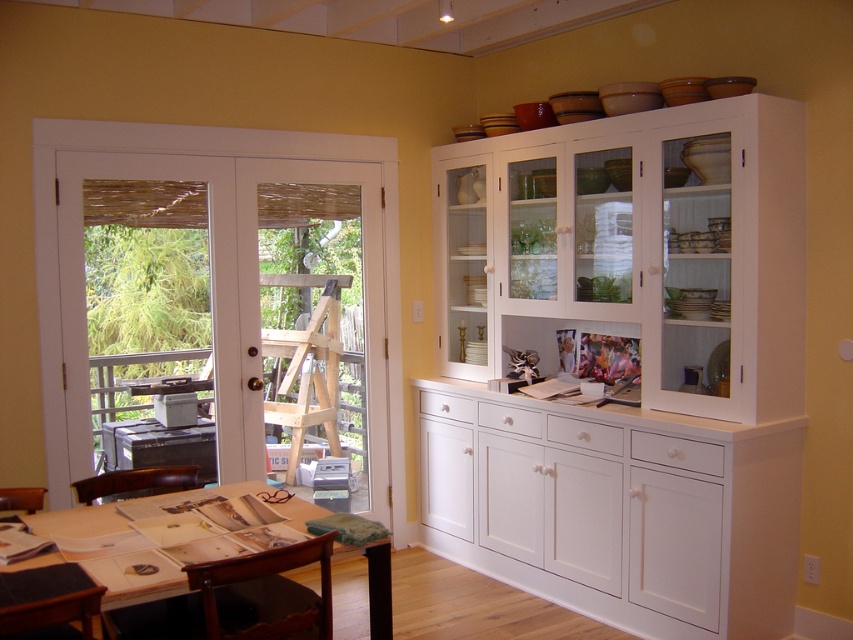
Question: Does white glass door at left have a greater width compared to wooden table at lower left?

Choices:
 (A) no
 (B) yes

Answer: (A)

Question: Which object appears farthest from the camera in this image?

Choices:
 (A) white glass door at left
 (B) wooden table at lower left

Answer: (A)

Question: Where is white glass door at left located in relation to wooden table at lower left in the image?

Choices:
 (A) left
 (B) right

Answer: (A)

Question: Which point is farther to the camera?

Choices:
 (A) (370, 570)
 (B) (68, 392)

Answer: (B)

Question: Which object appears closest to the camera in this image?

Choices:
 (A) wooden table at lower left
 (B) white glass door at left

Answer: (A)

Question: Is white glass door at left further to camera compared to wooden table at lower left?

Choices:
 (A) no
 (B) yes

Answer: (B)